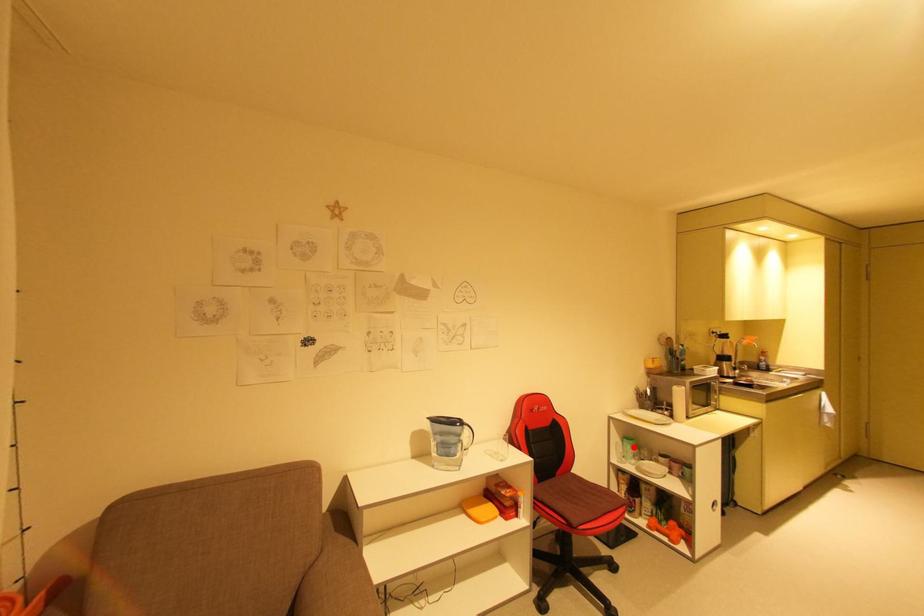
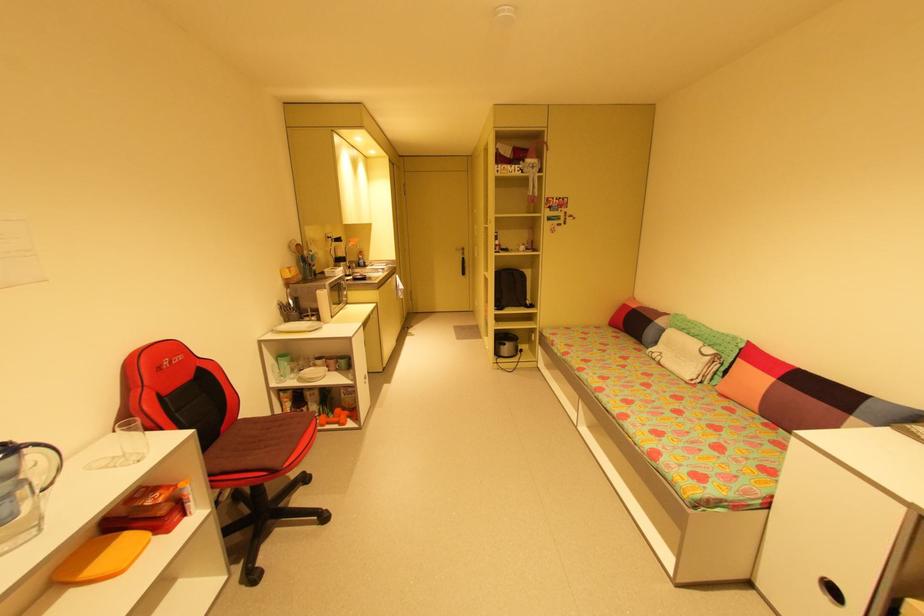
Locate, in the second image, the point that corresponds to the highlighted location in the first image.

(290, 363)